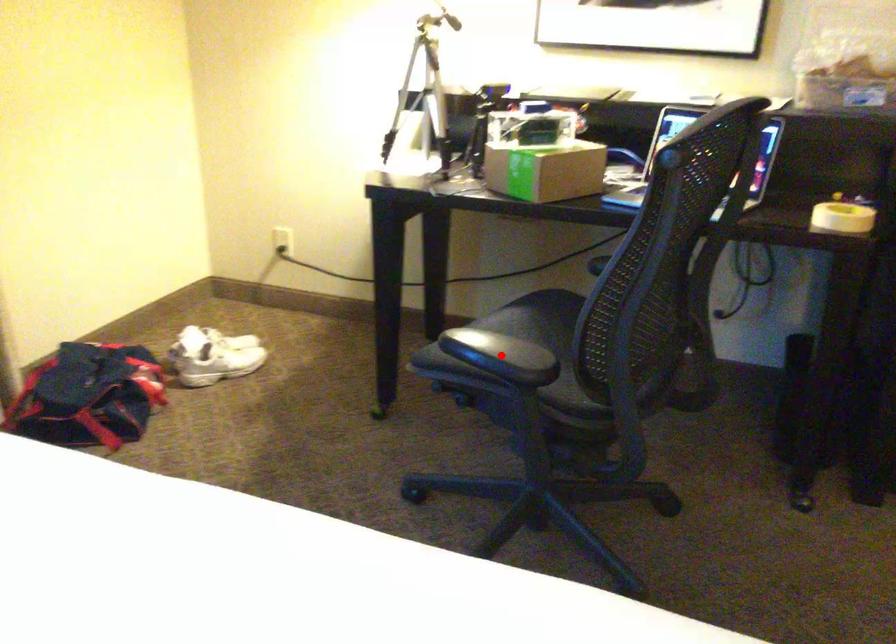
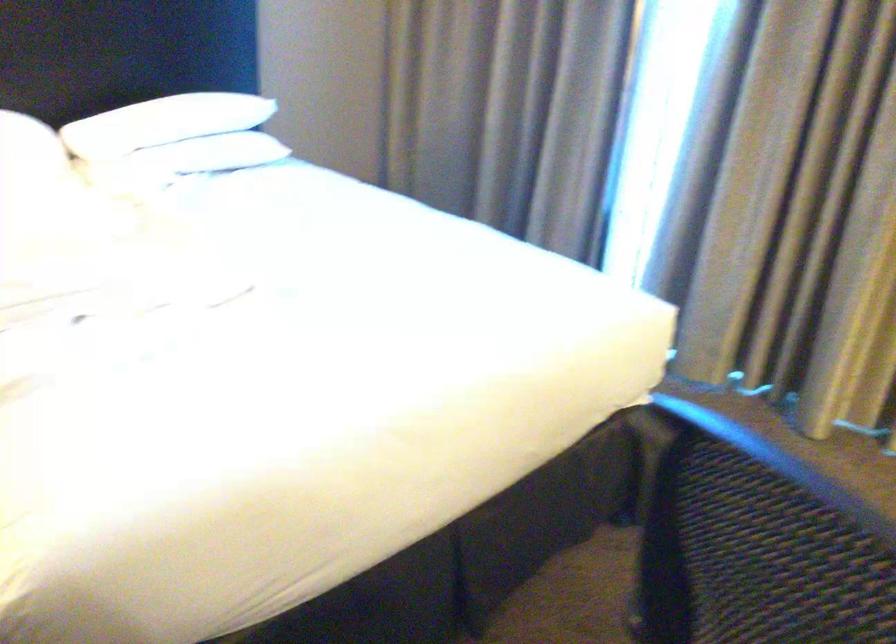
Question: I am providing you with two images of the same scene from different viewpoints. A red point is marked on the first image. At the location where the point appears in image 1, is it still visible in image 2?

Choices:
 (A) Yes
 (B) No

Answer: (B)